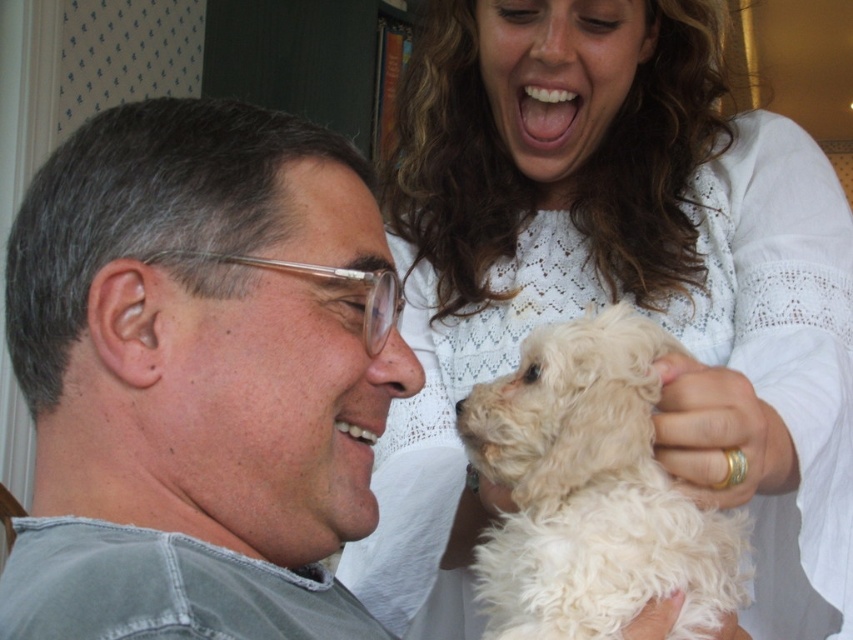
In the scene shown: You are a photographer standing in the scene and want to take a closeup photo of the white lace sweater at upper center. The camera you are using has a minimum focusing distance of 30 inches. Will you be able to take the photo without moving closer?

The white lace sweater at upper center is 29.25 inches from the viewer, which is within the camera minimum focusing distance of 30 inches. Therefore, you can take the photo without moving closer.

You are trying to decide whether to place a new decorative item on the white lace sweater at upper center or the white fluffy dog at upper right. Based on their sizes, which surface can accommodate a larger object?

The white lace sweater at upper center has a larger width than the white fluffy dog at upper right, so it can accommodate a larger object.